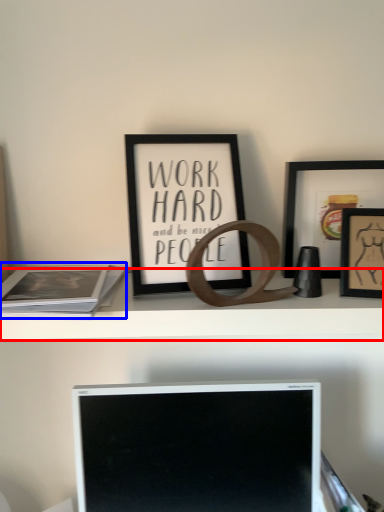
Question: Which object is further to the camera taking this photo, shelf (highlighted by a red box) or paperback book (highlighted by a blue box)?

Choices:
 (A) shelf
 (B) paperback book

Answer: (A)